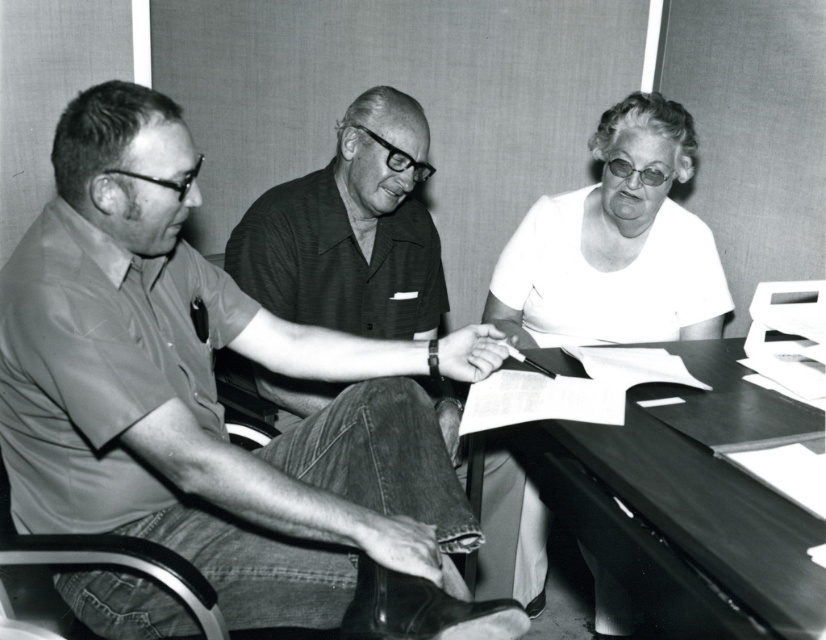
Is matte gray shirt at center to the right of white matte shirt at center from the viewer's perspective?

Incorrect, matte gray shirt at center is not on the right side of white matte shirt at center.

Between point (338, 490) and point (530, 244), which one is positioned in front?

Point (338, 490) is more forward.

Locate an element on the screen. matte gray shirt at center is located at coordinates (207, 392).

Does smooth dark wood table at center come behind white matte shirt at center?

No, it is in front of white matte shirt at center.

Which is in front, point (820, 573) or point (680, 232)?

Point (820, 573) is in front.

Looking at this image, who is more distant from viewer, (x=649, y=396) or (x=676, y=172)?

Positioned behind is point (x=676, y=172).

The height and width of the screenshot is (640, 826). Identify the location of smooth dark wood table at center. (679, 515).

Can you confirm if matte gray shirt at center is positioned to the left of smooth dark wood table at center?

Indeed, matte gray shirt at center is positioned on the left side of smooth dark wood table at center.

Is point (267, 465) positioned in front of point (806, 627)?

No.

Is point (96, 225) positioned after point (717, 492)?

Yes, it is.

At what (x,y) coordinates should I click in order to perform the action: click on matte gray shirt at center. Please return your answer as a coordinate pair (x, y). Image resolution: width=826 pixels, height=640 pixels. Looking at the image, I should click on (207, 392).